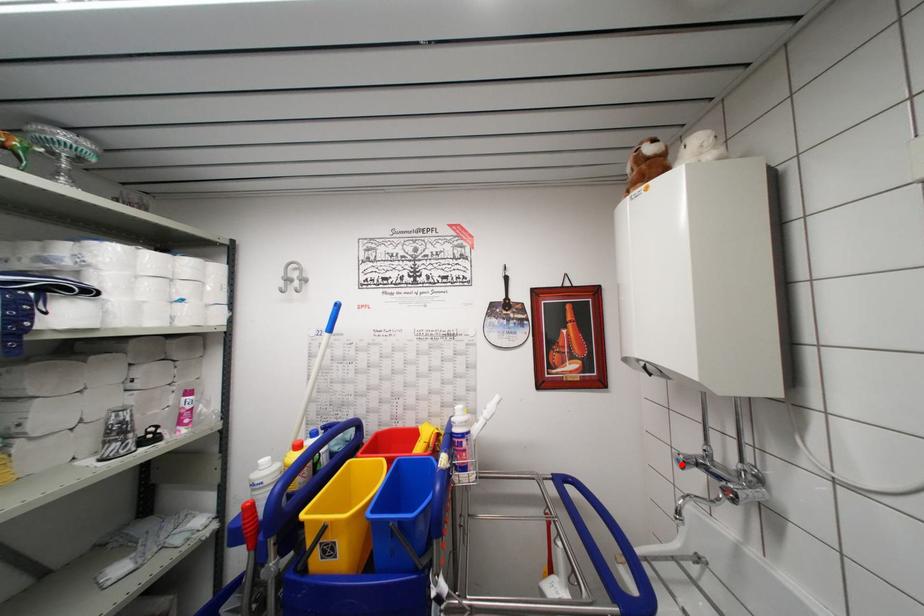
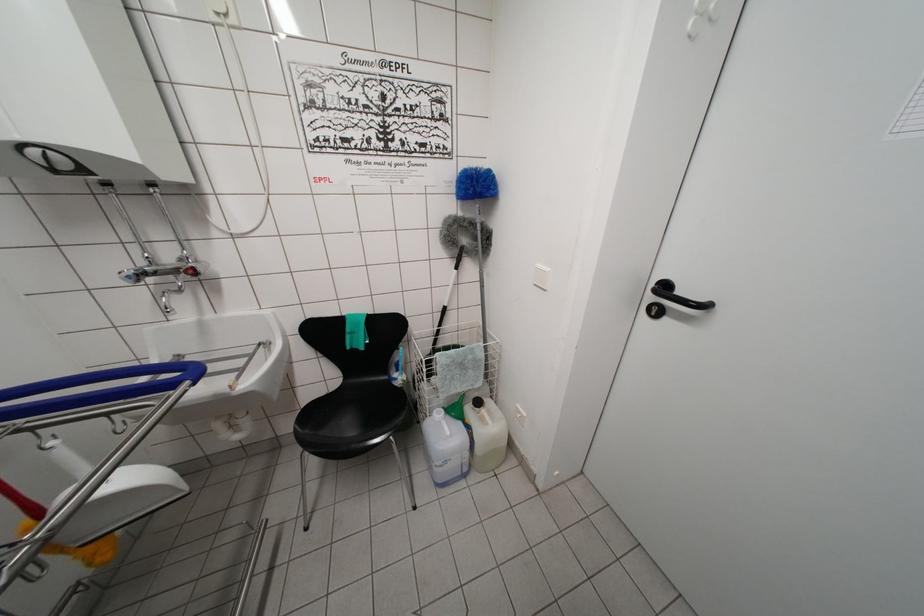
Find the pixel in the second image that matches the highlighted location in the first image.

(131, 282)